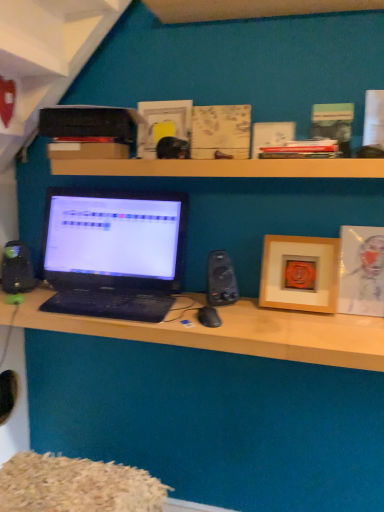
I want to click on vacant region to the left of black matte mouse at center, so click(164, 325).